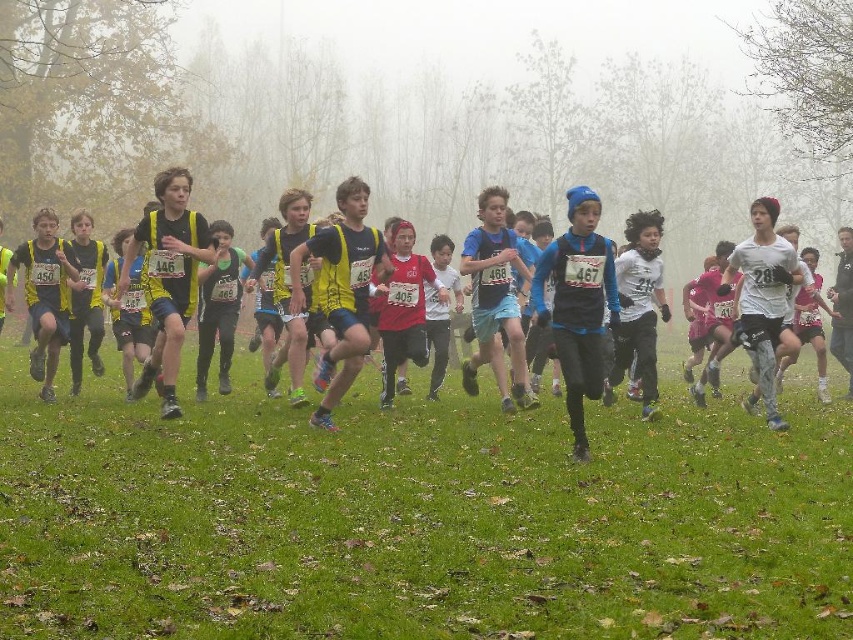
Question: Does white matte shirt at center appear on the right side of yellow fabric vest at center?

Choices:
 (A) yes
 (B) no

Answer: (A)

Question: Is white matte shirt at center bigger than yellow fabric vest at center?

Choices:
 (A) no
 (B) yes

Answer: (B)

Question: Considering the relative positions of white matte shirt at center and yellow fabric vest at center in the image provided, where is white matte shirt at center located with respect to yellow fabric vest at center?

Choices:
 (A) right
 (B) left

Answer: (A)

Question: Which point is closer to the camera?

Choices:
 (A) white matte shirt at center
 (B) yellow fabric vest at center

Answer: (B)

Question: Which of the following is the farthest from the observer?

Choices:
 (A) yellow fabric vest at center
 (B) white matte shirt at center

Answer: (B)

Question: Among these objects, which one is nearest to the camera?

Choices:
 (A) yellow fabric vest at center
 (B) white matte shirt at center

Answer: (A)